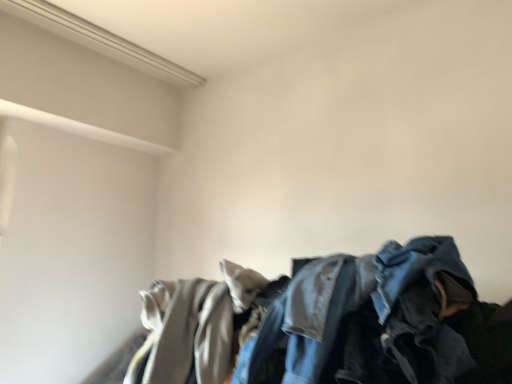
The width and height of the screenshot is (512, 384). In order to click on denim jacket at lower right in this screenshot , I will do `click(379, 323)`.

The height and width of the screenshot is (384, 512). Describe the element at coordinates (379, 323) in the screenshot. I see `denim jacket at lower right` at that location.

You are a GUI agent. You are given a task and a screenshot of the screen. Output one action in this format:
    pyautogui.click(x=<x>, y=<y>)
    Task: Click on the denim jacket at lower right
    
    Given the screenshot: What is the action you would take?
    tap(379, 323)